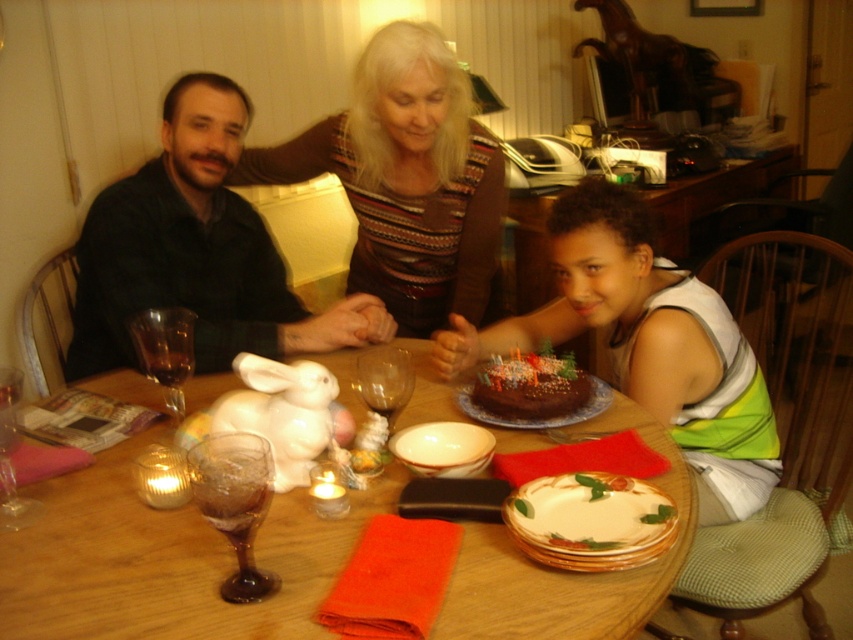
You are a server at a restaurant and need to place a 18 inch long decorative plate between the transparent glass wine glass at center and the transparent glass at table left. Will there be enough space to fit the plate between them?

The distance between the transparent glass wine glass at center and the transparent glass at table left is 20.34 inches. Since the decorative plate is 18 inches long, there is enough space to fit it between them as 18 inches is less than 20.34 inches.

You are a guest at this family gathering and want to know where the matte black shirt at left and the brown textured sweater at upper center are positioned relative to each other. Can you describe their spatial relationship?

→ The matte black shirt at left is located below the brown textured sweater at upper center.

You are sitting at the dining table and want to reach for an item located at point (70, 586) and another item at point (219, 454). Which item will you grab first if you extend your hand straight out from your chest?

You will grab the item at point (70, 586) first because it is closer to you than the item at point (219, 454).